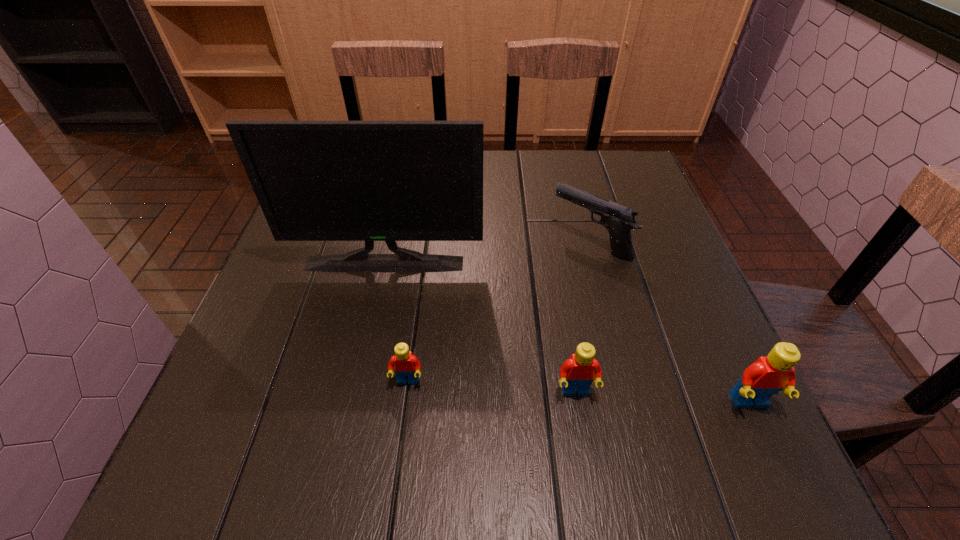
Where is `object that stands as the fourth closest to the shortest Lego`? This screenshot has width=960, height=540. object that stands as the fourth closest to the shortest Lego is located at coordinates (768, 375).

Identify which object is the fourth nearest to the rightmost object. Please provide its 2D coordinates. Your answer should be formatted as a tuple, i.e. [(x, y)], where the tuple contains the x and y coordinates of a point satisfying the conditions above.

[(406, 365)]

Find the location of a particular element. The image size is (960, 540). Lego that is the second nearest to the monitor is located at coordinates (578, 372).

Identify which Lego is the second closest to the gun. Please provide its 2D coordinates. Your answer should be formatted as a tuple, i.e. [(x, y)], where the tuple contains the x and y coordinates of a point satisfying the conditions above.

[(768, 375)]

Locate an element on the screen. The width and height of the screenshot is (960, 540). free space that satisfies the following two spatial constraints: 1. at the muzzle of the gun; 2. on the face of the shortest object is located at coordinates (627, 382).

This screenshot has width=960, height=540. I want to click on vacant space that satisfies the following two spatial constraints: 1. at the muzzle of the gun; 2. on the face of the second shortest Lego, so click(x=630, y=392).